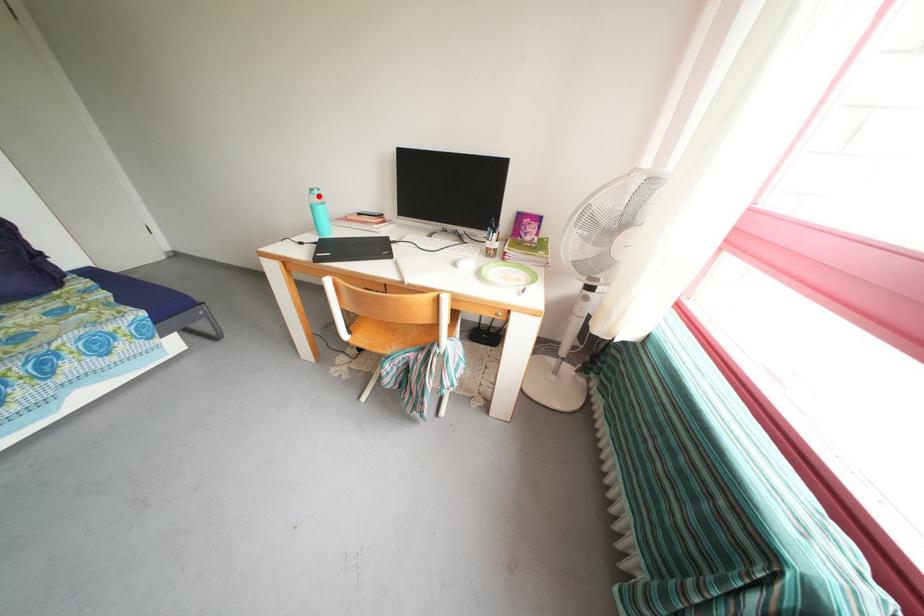
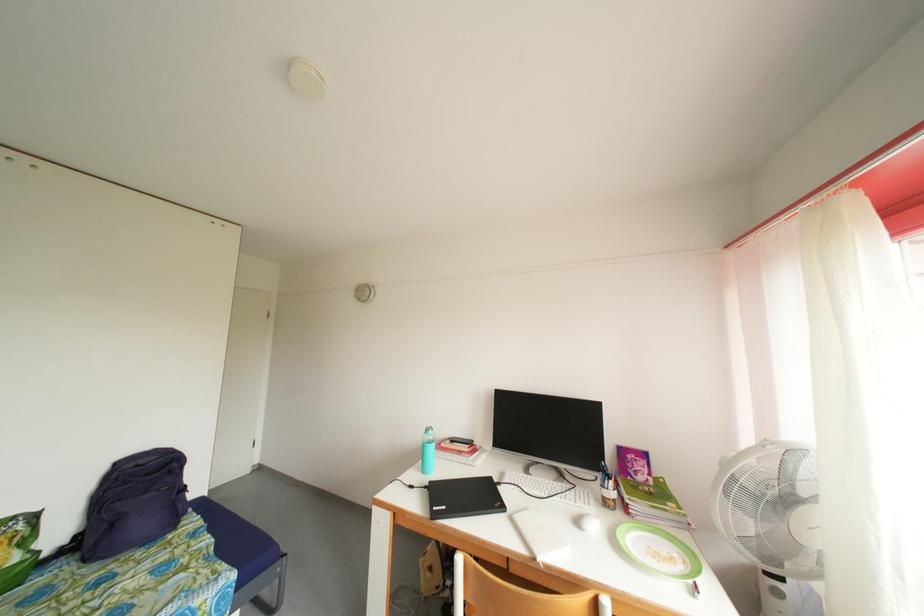
The point at the highlighted location is marked in the first image. Where is the corresponding point in the second image?

(434, 436)